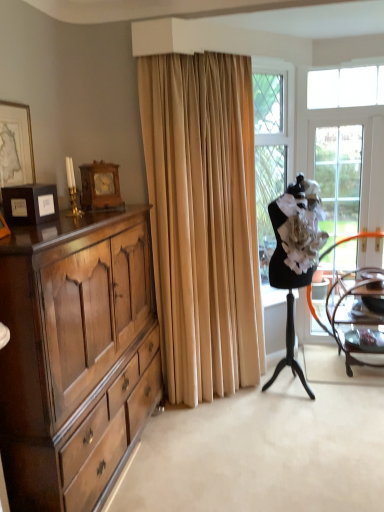
Question: Is white fabric ballet dancer at right positioned in front of clear glass screen door at right?

Choices:
 (A) yes
 (B) no

Answer: (A)

Question: Is white fabric ballet dancer at right outside clear glass screen door at right?

Choices:
 (A) yes
 (B) no

Answer: (A)

Question: Is white fabric ballet dancer at right bigger than clear glass screen door at right?

Choices:
 (A) yes
 (B) no

Answer: (A)

Question: From a real-world perspective, is white fabric ballet dancer at right positioned over clear glass screen door at right based on gravity?

Choices:
 (A) yes
 (B) no

Answer: (B)

Question: Is white fabric ballet dancer at right at the left side of clear glass screen door at right?

Choices:
 (A) no
 (B) yes

Answer: (B)

Question: Is white fabric ballet dancer at right facing away from clear glass screen door at right?

Choices:
 (A) no
 (B) yes

Answer: (A)

Question: Is white fabric ballet dancer at right next to polished wood cabinet at left and touching it?

Choices:
 (A) no
 (B) yes

Answer: (A)

Question: Is white fabric ballet dancer at right oriented away from polished wood cabinet at left?

Choices:
 (A) no
 (B) yes

Answer: (A)

Question: Does white fabric ballet dancer at right have a larger size compared to polished wood cabinet at left?

Choices:
 (A) yes
 (B) no

Answer: (B)

Question: From a real-world perspective, is white fabric ballet dancer at right physically above polished wood cabinet at left?

Choices:
 (A) yes
 (B) no

Answer: (A)

Question: Is white fabric ballet dancer at right thinner than polished wood cabinet at left?

Choices:
 (A) no
 (B) yes

Answer: (B)

Question: Is white fabric ballet dancer at right shorter than polished wood cabinet at left?

Choices:
 (A) yes
 (B) no

Answer: (B)

Question: Does beige velvet curtain at center have a greater width compared to white fabric ballet dancer at right?

Choices:
 (A) no
 (B) yes

Answer: (A)